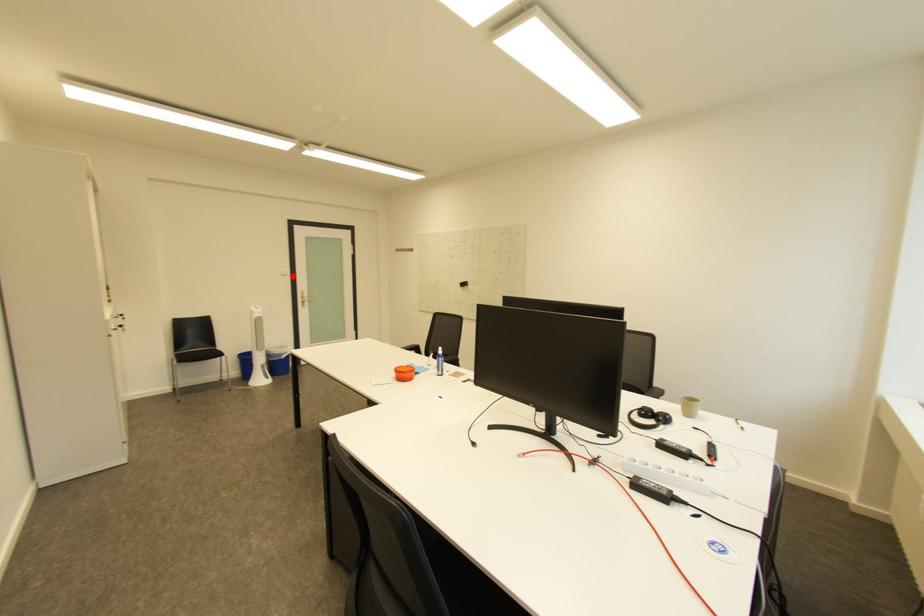
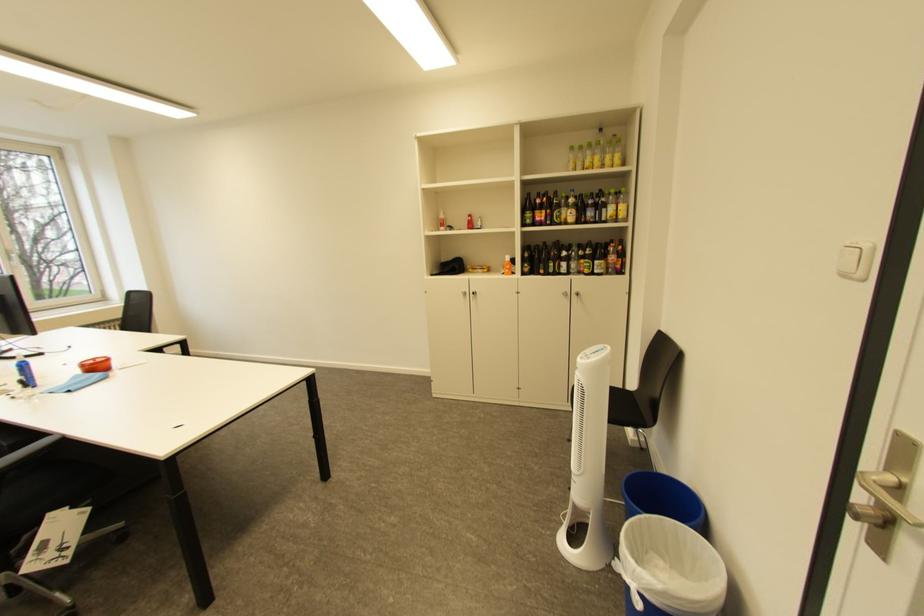
In the second image, find the point that corresponds to the highlighted location in the first image.

(855, 277)